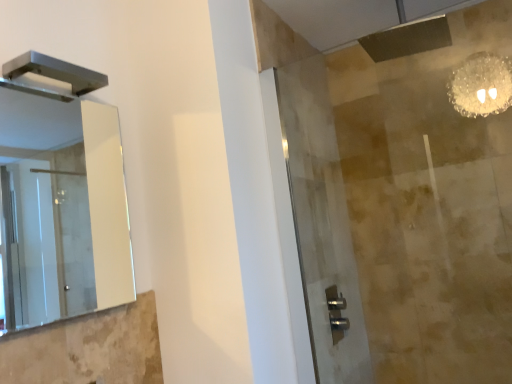
This screenshot has height=384, width=512. Describe the element at coordinates (66, 207) in the screenshot. I see `clear glass mirror at left` at that location.

I want to click on clear glass shower door at center, so click(x=322, y=224).

The width and height of the screenshot is (512, 384). What do you see at coordinates (55, 71) in the screenshot? I see `metallic rectangular fixture at upper left` at bounding box center [55, 71].

At what (x,y) coordinates should I click in order to perform the action: click on clear glass mirror at left. Please return your answer as a coordinate pair (x, y). The width and height of the screenshot is (512, 384). Looking at the image, I should click on (66, 207).

How distant is clear glass mirror at left from metallic rectangular fixture at upper left?

clear glass mirror at left and metallic rectangular fixture at upper left are 1.77 meters apart from each other.

Considering the positions of objects clear glass mirror at left and metallic rectangular fixture at upper left in the image provided, who is in front, clear glass mirror at left or metallic rectangular fixture at upper left?

clear glass mirror at left is closer to the camera.

Considering the positions of objects clear glass mirror at left and metallic rectangular fixture at upper left in the image provided, who is more to the right, clear glass mirror at left or metallic rectangular fixture at upper left?

Positioned to the right is clear glass mirror at left.

Is clear glass mirror at left far away from metallic rectangular fixture at upper left?

That's right, there is a large distance between clear glass mirror at left and metallic rectangular fixture at upper left.

Which point is more distant from viewer, (355,301) or (106,144)?

Positioned behind is point (355,301).

What's the angular difference between clear glass shower door at center and clear glass mirror at left's facing directions?

1.19 degrees.

From a real-world perspective, is clear glass shower door at center positioned over clear glass mirror at left based on gravity?

No.

Considering the sizes of objects clear glass shower door at center and clear glass mirror at left in the image provided, who is wider, clear glass shower door at center or clear glass mirror at left?

Wider between the two is clear glass shower door at center.

Does clear glass shower door at center have a greater width compared to metallic rectangular fixture at upper left?

Incorrect, the width of clear glass shower door at center does not surpass that of metallic rectangular fixture at upper left.

Are clear glass shower door at center and metallic rectangular fixture at upper left far apart?

Yes.

Between point (297, 103) and point (9, 75), which one is positioned in front?

The point (9, 75) is closer.

Considering the relative positions of clear glass shower door at center and metallic rectangular fixture at upper left in the image provided, is clear glass shower door at center to the left of metallic rectangular fixture at upper left from the viewer's perspective?

Incorrect, clear glass shower door at center is not on the left side of metallic rectangular fixture at upper left.

Locate an element on the screen. The width and height of the screenshot is (512, 384). shower behind the clear glass mirror at left is located at coordinates (55, 71).

From the image's perspective, does metallic rectangular fixture at upper left appear lower than clear glass mirror at left?

No.

Is metallic rectangular fixture at upper left to the right of clear glass mirror at left from the viewer's perspective?

No, metallic rectangular fixture at upper left is not to the right of clear glass mirror at left.

Consider the image. Is metallic rectangular fixture at upper left further to the viewer compared to clear glass mirror at left?

Yes, it is.

Considering their positions, is clear glass mirror at left located in front of or behind clear glass shower door at center?

Visually, clear glass mirror at left is located in front of clear glass shower door at center.

Is clear glass mirror at left positioned with its back to clear glass shower door at center?

That's not correct — clear glass mirror at left is not looking away from clear glass shower door at center.

In the scene shown: Which of these two, clear glass mirror at left or clear glass shower door at center, is bigger?

With larger size is clear glass shower door at center.

Who is more distant, metallic rectangular fixture at upper left or clear glass shower door at center?

clear glass shower door at center is further away from the camera.

From the image's perspective, is metallic rectangular fixture at upper left located beneath clear glass shower door at center?

No.

Locate an element on the screen. shower in front of the clear glass shower door at center is located at coordinates (55, 71).

Which is behind, point (21, 72) or point (315, 374)?

Point (315, 374)

Where is `shower behind the clear glass mirror at left`? This screenshot has height=384, width=512. shower behind the clear glass mirror at left is located at coordinates (x=55, y=71).

At what (x,y) coordinates should I click in order to perform the action: click on mirror above the clear glass shower door at center (from the image's perspective). Please return your answer as a coordinate pair (x, y). The height and width of the screenshot is (384, 512). Looking at the image, I should click on (66, 207).

From the image, which object appears to be farther from clear glass mirror at left, metallic rectangular fixture at upper left or clear glass shower door at center?

metallic rectangular fixture at upper left is positioned further to the anchor clear glass mirror at left.

Which object lies nearer to the anchor point clear glass shower door at center, metallic rectangular fixture at upper left or clear glass mirror at left?

metallic rectangular fixture at upper left lies closer to clear glass shower door at center than the other object.

When comparing their distances from metallic rectangular fixture at upper left, does clear glass mirror at left or clear glass shower door at center seem further?

Based on the image, clear glass mirror at left appears to be further to metallic rectangular fixture at upper left.

From the picture: Based on their spatial positions, is clear glass shower door at center or clear glass mirror at left closer to metallic rectangular fixture at upper left?

clear glass shower door at center.

Which object lies nearer to the anchor point clear glass mirror at left, clear glass shower door at center or metallic rectangular fixture at upper left?

clear glass shower door at center is closer to clear glass mirror at left.

Based on their spatial positions, is clear glass mirror at left or metallic rectangular fixture at upper left closer to clear glass shower door at center?

metallic rectangular fixture at upper left lies closer to clear glass shower door at center than the other object.

I want to click on mirror located between metallic rectangular fixture at upper left and clear glass shower door at center in the left-right direction, so click(x=66, y=207).